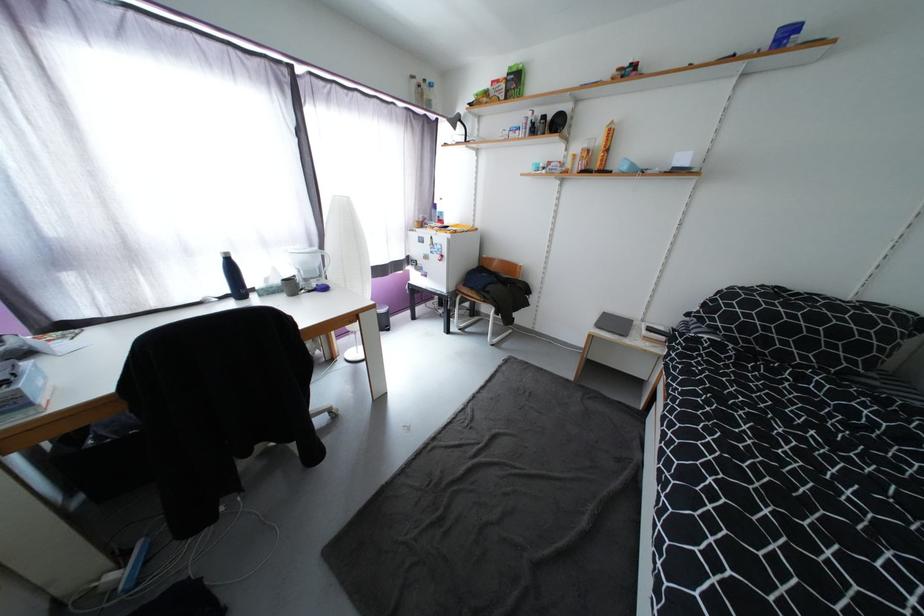
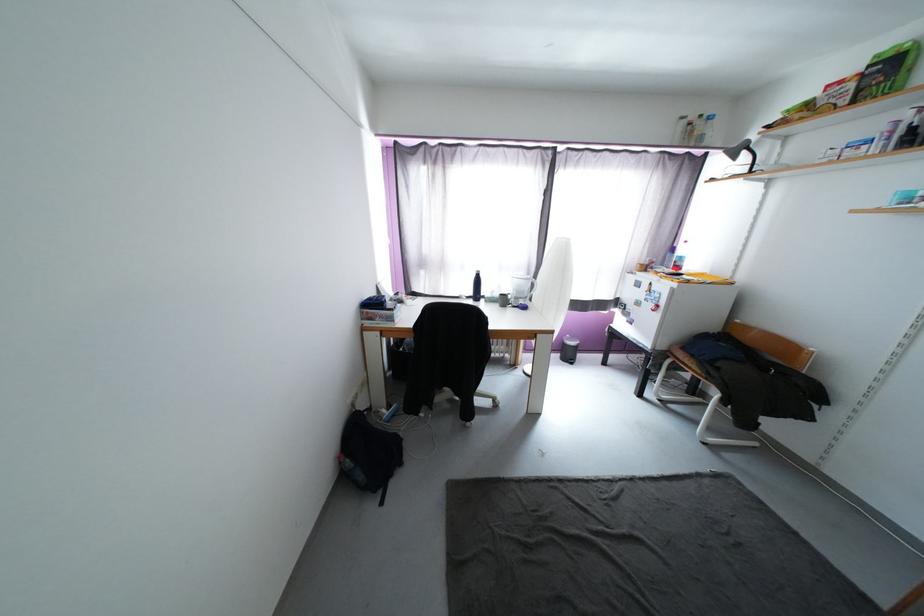
The point at [465,126] is marked in the first image. Where is the corresponding point in the second image?

(749, 154)